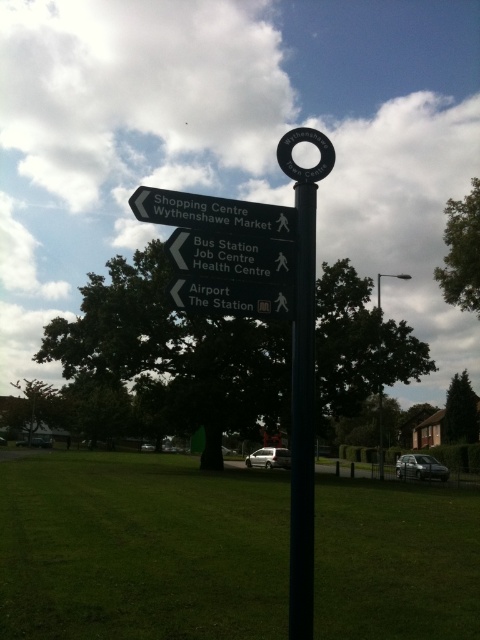
Does black plastic sign at upper left have a smaller size compared to white matte car at center?

No.

Which is above, black plastic sign at upper left or white matte car at center?

black plastic sign at upper left is higher up.

Is point (218, 220) less distant than point (260, 451)?

Yes, it is.

Locate an element on the screen. This screenshot has height=640, width=480. black plastic sign at upper left is located at coordinates (213, 212).

Can you confirm if white plastic sign at center is bigger than metallic silver suv at lower right?

Incorrect, white plastic sign at center is not larger than metallic silver suv at lower right.

Can you confirm if white plastic sign at center is positioned above metallic silver suv at lower right?

Yes.

This screenshot has height=640, width=480. In order to click on white plastic sign at center in this screenshot , I will do `click(231, 298)`.

Measure the distance from black metal pole at center to white plastic sign at center.

A distance of 43.62 centimeters exists between black metal pole at center and white plastic sign at center.

Is black metal pole at center taller than white plastic sign at center?

Indeed, black metal pole at center has a greater height compared to white plastic sign at center.

The image size is (480, 640). I want to click on black metal pole at center, so click(302, 419).